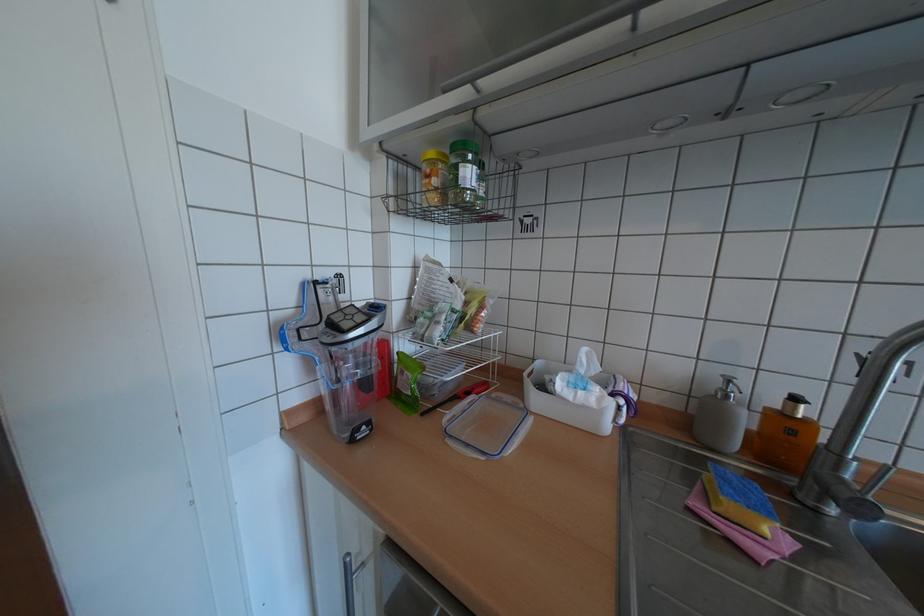
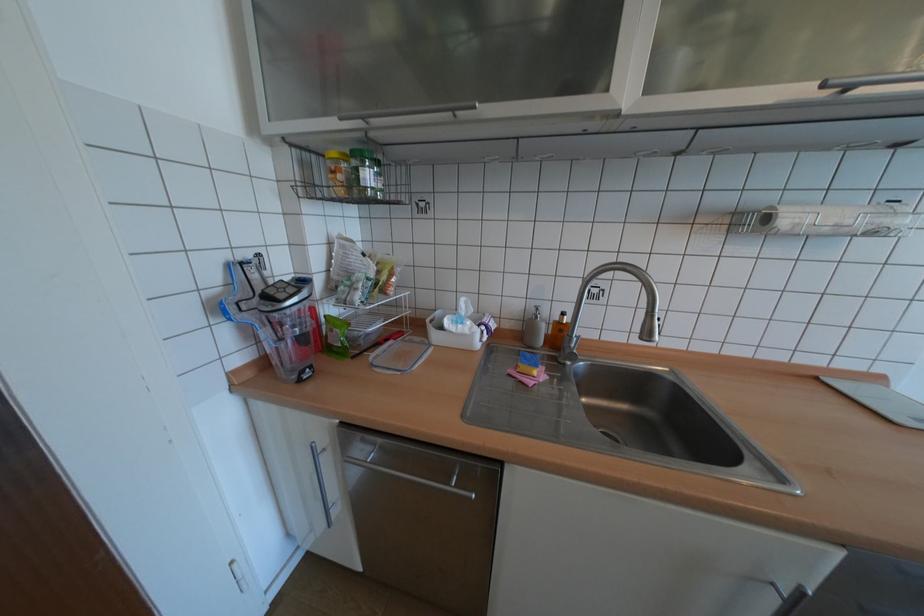
In the second image, find the point that corresponds to pixel 444 180 in the first image.

(348, 177)